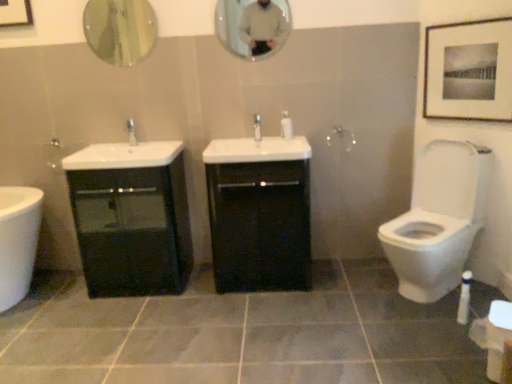
Find the location of a particular element. The width and height of the screenshot is (512, 384). vacant area that lies to the right of black glossy cabinet at left, which is counted as the 1th bathroom cabinet, starting from the left is located at coordinates (205, 294).